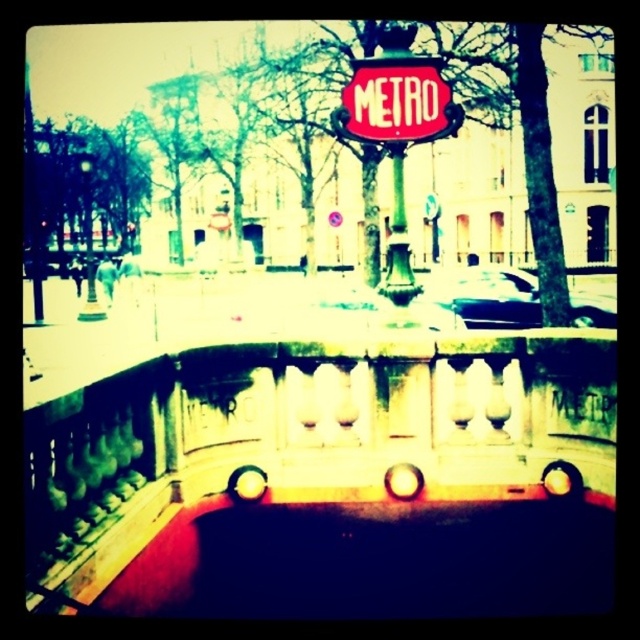
Question: Is stone balustrade at center wider than red glossy metro sign at center?

Choices:
 (A) no
 (B) yes

Answer: (B)

Question: Which object appears closest to the camera in this image?

Choices:
 (A) shiny black car at center
 (B) stone balustrade at center

Answer: (B)

Question: Which is farther from the green polished metal pole at center?

Choices:
 (A) red glossy metro sign at center
 (B) stone balustrade at center
 (C) shiny black car at center

Answer: (C)

Question: From the image, what is the correct spatial relationship of stone balustrade at center in relation to shiny black car at center?

Choices:
 (A) below
 (B) above

Answer: (A)

Question: Which is nearer to the shiny black car at center?

Choices:
 (A) stone balustrade at center
 (B) green polished metal pole at center

Answer: (B)

Question: Is shiny black car at center below green polished metal pole at center?

Choices:
 (A) yes
 (B) no

Answer: (A)